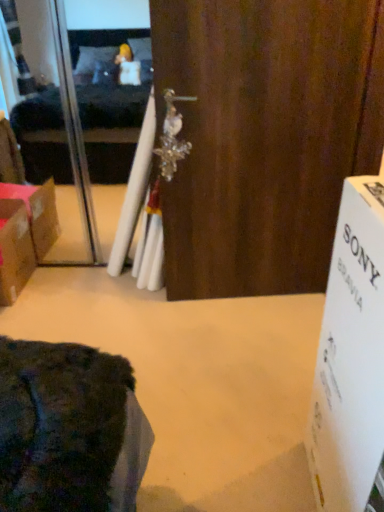
Find the location of a particular element. free space to the left of wooden door at center is located at coordinates (144, 317).